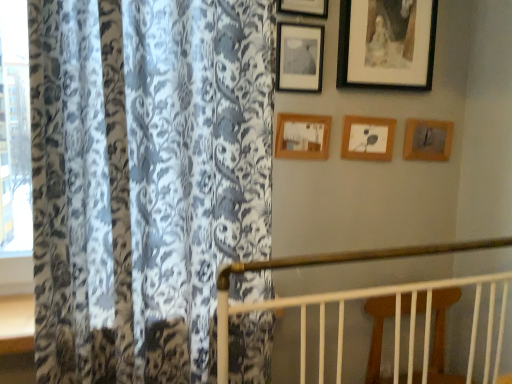
At what (x,y) coordinates should I click in order to perform the action: click on wooden picture frame at upper right, marked as the 6th picture frame in a left-to-right arrangement. Please return your answer as a coordinate pair (x, y). Image resolution: width=512 pixels, height=384 pixels. Looking at the image, I should click on (426, 140).

Where is `wooden picture frame at center, positioned as the 3th picture frame in left-to-right order`? wooden picture frame at center, positioned as the 3th picture frame in left-to-right order is located at coordinates (302, 136).

Image resolution: width=512 pixels, height=384 pixels. What do you see at coordinates (386, 43) in the screenshot?
I see `black matte picture frame at upper right, positioned as the second picture frame in right-to-left order` at bounding box center [386, 43].

The image size is (512, 384). What are the coordinates of `floral-patterned fabric at left` in the screenshot? It's located at (144, 180).

You are a GUI agent. You are given a task and a screenshot of the screen. Output one action in this format:
    pyautogui.click(x=<x>, y=<y>)
    Task: Click on the wooden picture frame at upper right, marked as the first picture frame in a right-to-left arrangement
    The image size is (512, 384).
    Given the screenshot: What is the action you would take?
    pyautogui.click(x=426, y=140)

From the image's perspective, does wooden picture frame at center, marked as the fourth picture frame in a right-to-left arrangement, appear higher than black matte picture frame at upper right, the 5th picture frame positioned from the left?

Incorrect, from the image's perspective, wooden picture frame at center, marked as the fourth picture frame in a right-to-left arrangement, is lower than black matte picture frame at upper right, the 5th picture frame positioned from the left.

Considering the positions of objects wooden picture frame at center, positioned as the 3th picture frame in left-to-right order, and black matte picture frame at upper right, positioned as the second picture frame in right-to-left order, in the image provided, who is in front, wooden picture frame at center, positioned as the 3th picture frame in left-to-right order, or black matte picture frame at upper right, positioned as the second picture frame in right-to-left order,?

black matte picture frame at upper right, positioned as the second picture frame in right-to-left order, is closer to the camera.

Does wooden picture frame at center, positioned as the 3th picture frame in left-to-right order, have a smaller size compared to black matte picture frame at upper right, positioned as the second picture frame in right-to-left order?

Correct, wooden picture frame at center, positioned as the 3th picture frame in left-to-right order, occupies less space than black matte picture frame at upper right, positioned as the second picture frame in right-to-left order.

Which of these two, wooden picture frame at upper right, marked as the first picture frame in a right-to-left arrangement, or matte black picture frame at upper center, the first picture frame when ordered from left to right, stands shorter?

Standing shorter between the two is wooden picture frame at upper right, marked as the first picture frame in a right-to-left arrangement.

Is point (421, 149) positioned in front of point (304, 76)?

No, it is not.

Is wooden picture frame at upper right, marked as the 6th picture frame in a left-to-right arrangement, facing away from matte black picture frame at upper center, the first picture frame when ordered from left to right?

wooden picture frame at upper right, marked as the 6th picture frame in a left-to-right arrangement, is not turned away from matte black picture frame at upper center, the first picture frame when ordered from left to right.

How many degrees apart are the facing directions of wooden picture frame at upper right, marked as the first picture frame in a right-to-left arrangement, and matte black picture frame at upper center, which appears as the 6th picture frame when viewed from the right?

The angular difference between wooden picture frame at upper right, marked as the first picture frame in a right-to-left arrangement, and matte black picture frame at upper center, which appears as the 6th picture frame when viewed from the right, is 0.00701 degrees.

In order to click on picture frame located above the black matte picture frame at upper right, the 5th picture frame positioned from the left (from the image's perspective) in this screenshot , I will do `click(304, 8)`.

Is point (370, 81) closer or farther from the camera than point (312, 14)?

Point (370, 81).

Would you say black matte picture frame at upper right, the 5th picture frame positioned from the left, is inside or outside wooden picture frame at upper center, the fifth picture frame when ordered from right to left?

black matte picture frame at upper right, the 5th picture frame positioned from the left, is located beyond the bounds of wooden picture frame at upper center, the fifth picture frame when ordered from right to left.

Considering the relative sizes of floral-patterned fabric at left and black matte picture frame at upper right, positioned as the second picture frame in right-to-left order, in the image provided, is floral-patterned fabric at left smaller than black matte picture frame at upper right, positioned as the second picture frame in right-to-left order,?

No.

From the picture: From the image's perspective, relative to black matte picture frame at upper right, the 5th picture frame positioned from the left, is floral-patterned fabric at left above or below?

floral-patterned fabric at left is situated lower than black matte picture frame at upper right, the 5th picture frame positioned from the left, in the image.

From a real-world perspective, is floral-patterned fabric at left on top of black matte picture frame at upper right, the 5th picture frame positioned from the left?

No, from a real-world perspective, floral-patterned fabric at left is not over black matte picture frame at upper right, the 5th picture frame positioned from the left

Is floral-patterned fabric at left taller or shorter than black matte picture frame at upper right, positioned as the second picture frame in right-to-left order?

In the image, floral-patterned fabric at left appears to be taller than black matte picture frame at upper right, positioned as the second picture frame in right-to-left order.

Is floral-patterned fabric at left not inside matte black picture frame at upper center, which appears as the 6th picture frame when viewed from the right?

Yes.

In the scene shown: From a real-world perspective, between floral-patterned fabric at left and matte black picture frame at upper center, which appears as the 6th picture frame when viewed from the right, who is vertically higher?

matte black picture frame at upper center, which appears as the 6th picture frame when viewed from the right, from a real-world perspective.

What's the angular difference between floral-patterned fabric at left and matte black picture frame at upper center, which appears as the 6th picture frame when viewed from the right,'s facing directions?

floral-patterned fabric at left and matte black picture frame at upper center, which appears as the 6th picture frame when viewed from the right, are facing 3.13 degrees away from each other.

From a real-world perspective, which picture frame is the 4th one above the floral-patterned fabric at left? Please provide its 2D coordinates.

[(298, 57)]

Is wooden picture frame at upper center, the fifth picture frame when ordered from right to left, inside the boundaries of wooden picture frame at upper right, marked as the 6th picture frame in a left-to-right arrangement, or outside?

wooden picture frame at upper center, the fifth picture frame when ordered from right to left, is not inside wooden picture frame at upper right, marked as the 6th picture frame in a left-to-right arrangement, it's outside.

In order to click on the 5th picture frame in front of the wooden picture frame at upper right, marked as the first picture frame in a right-to-left arrangement in this screenshot , I will do `click(304, 8)`.

From the image's perspective, relative to wooden picture frame at upper right, marked as the 6th picture frame in a left-to-right arrangement, is wooden picture frame at upper center, which is the second picture frame from left to right, above or below?

wooden picture frame at upper center, which is the second picture frame from left to right, is above wooden picture frame at upper right, marked as the 6th picture frame in a left-to-right arrangement.

Which is farther, (322, 6) or (416, 120)?

The point (416, 120) is farther.

Considering the positions of objects wooden picture frame at upper right, marked as the 6th picture frame in a left-to-right arrangement, and wooden picture frame at center, positioned as the 3th picture frame in left-to-right order, in the image provided, who is more to the right, wooden picture frame at upper right, marked as the 6th picture frame in a left-to-right arrangement, or wooden picture frame at center, positioned as the 3th picture frame in left-to-right order,?

From the viewer's perspective, wooden picture frame at upper right, marked as the 6th picture frame in a left-to-right arrangement, appears more on the right side.

Looking at the image, does wooden picture frame at upper right, marked as the first picture frame in a right-to-left arrangement, seem bigger or smaller compared to wooden picture frame at center, positioned as the 3th picture frame in left-to-right order?

wooden picture frame at upper right, marked as the first picture frame in a right-to-left arrangement, is bigger than wooden picture frame at center, positioned as the 3th picture frame in left-to-right order.

Is wooden picture frame at upper right, marked as the first picture frame in a right-to-left arrangement, facing away from wooden picture frame at center, positioned as the 3th picture frame in left-to-right order?

No.

From a real-world perspective, count 2nd picture frames downward from the black matte picture frame at upper right, the 5th picture frame positioned from the left, and point to it. Please provide its 2D coordinates.

[(302, 136)]

Which picture frame is the 3rd one when counting from the back of the matte black picture frame at upper center, which appears as the 6th picture frame when viewed from the right? Please provide its 2D coordinates.

[(426, 140)]

Looking at the image, which one is located further to floral-patterned fabric at left, wooden picture frame at upper right, marked as the first picture frame in a right-to-left arrangement, or wooden picture frame at upper center, the 4th picture frame when ordered from left to right?

wooden picture frame at upper right, marked as the first picture frame in a right-to-left arrangement, is positioned further to the anchor floral-patterned fabric at left.

Based on their spatial positions, is floral-patterned fabric at left or wooden picture frame at upper center, the 4th picture frame when ordered from left to right, closer to black matte picture frame at upper right, the 5th picture frame positioned from the left?

Based on the image, wooden picture frame at upper center, the 4th picture frame when ordered from left to right, appears to be nearer to black matte picture frame at upper right, the 5th picture frame positioned from the left.

From the image, which object appears to be nearer to wooden picture frame at upper center, which is the second picture frame from left to right, wooden picture frame at upper center, positioned as the 3th picture frame in right-to-left order, or black matte picture frame at upper right, the 5th picture frame positioned from the left?

black matte picture frame at upper right, the 5th picture frame positioned from the left, is closer to wooden picture frame at upper center, which is the second picture frame from left to right.

Looking at the image, which one is located further to wooden picture frame at upper center, the fifth picture frame when ordered from right to left, black matte picture frame at upper right, the 5th picture frame positioned from the left, or wooden picture frame at center, positioned as the 3th picture frame in left-to-right order?

wooden picture frame at center, positioned as the 3th picture frame in left-to-right order, is positioned further to the anchor wooden picture frame at upper center, the fifth picture frame when ordered from right to left.

From the image, which object appears to be farther from wooden picture frame at upper center, the fifth picture frame when ordered from right to left, wooden picture frame at upper right, marked as the 6th picture frame in a left-to-right arrangement, or wooden picture frame at center, positioned as the 3th picture frame in left-to-right order?

wooden picture frame at upper right, marked as the 6th picture frame in a left-to-right arrangement, lies further to wooden picture frame at upper center, the fifth picture frame when ordered from right to left, than the other object.

When comparing their distances from wooden picture frame at upper right, marked as the first picture frame in a right-to-left arrangement, does floral-patterned fabric at left or wooden picture frame at center, positioned as the 3th picture frame in left-to-right order, seem further?

Based on the image, floral-patterned fabric at left appears to be further to wooden picture frame at upper right, marked as the first picture frame in a right-to-left arrangement.

Estimate the real-world distances between objects in this image. Which object is further from floral-patterned fabric at left, wooden picture frame at center, positioned as the 3th picture frame in left-to-right order, or wooden picture frame at upper center, which is the second picture frame from left to right?

Answer: The object further to floral-patterned fabric at left is wooden picture frame at upper center, which is the second picture frame from left to right.

Which object lies further to the anchor point wooden picture frame at center, marked as the fourth picture frame in a right-to-left arrangement, matte black picture frame at upper center, the first picture frame when ordered from left to right, or wooden picture frame at upper center, which is the second picture frame from left to right?

wooden picture frame at upper center, which is the second picture frame from left to right, is further to wooden picture frame at center, marked as the fourth picture frame in a right-to-left arrangement.